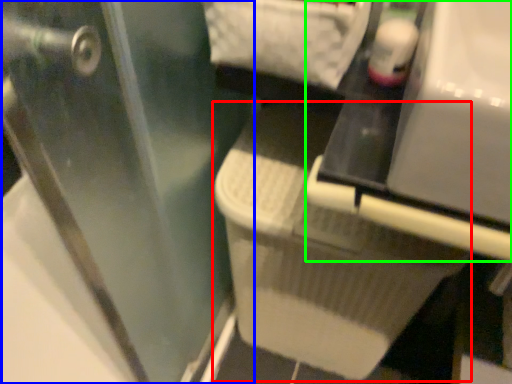
Question: Which is farther away from laundry basket (highlighted by a red box)? screen door (highlighted by a blue box) or vanity (highlighted by a green box)?

Choices:
 (A) screen door
 (B) vanity

Answer: (B)